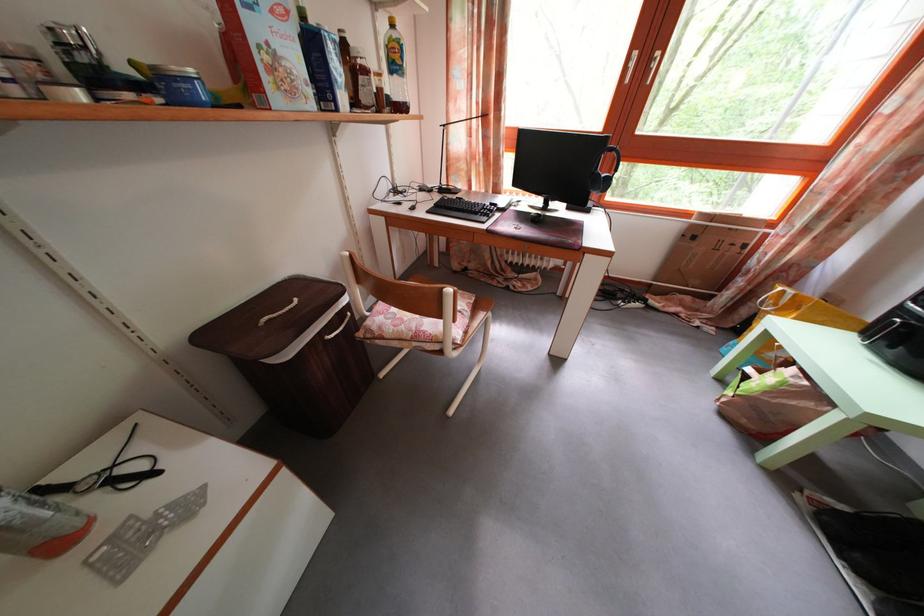
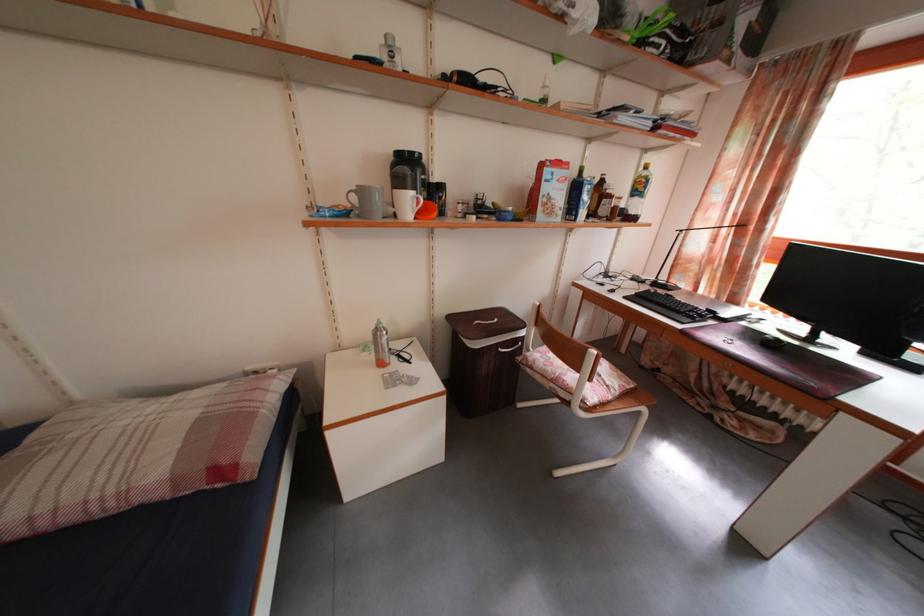
Question: The camera is either moving clockwise (left) or counter-clockwise (right) around the object. The first image is from the beginning of the video and the second image is from the end. Is the camera moving left or right when shooting the video?

Choices:
 (A) Left
 (B) Right

Answer: (B)